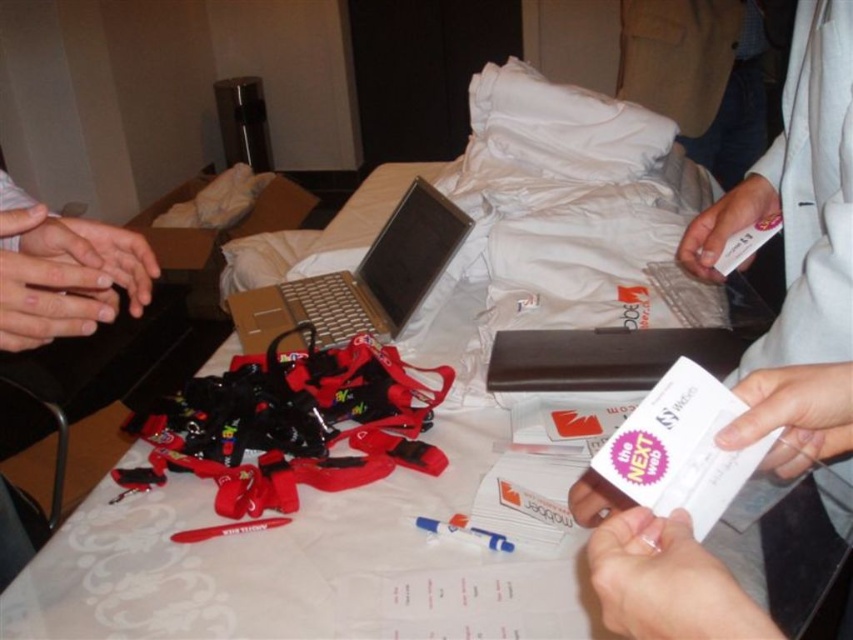
Question: Which of the following is the farthest from the observer?

Choices:
 (A) (566, 333)
 (B) (41, 288)
 (C) (648, 636)
 (D) (16, 342)

Answer: (A)

Question: Is silver metallic laptop at center closer to camera compared to white paper card at center?

Choices:
 (A) yes
 (B) no

Answer: (B)

Question: Is brown leather laptop at center thinner than white paper table at center?

Choices:
 (A) yes
 (B) no

Answer: (B)

Question: Which object is closer to the camera taking this photo?

Choices:
 (A) brown leather laptop at center
 (B) matte black hands at center
 (C) white paper card at center

Answer: (C)

Question: Is silver metallic laptop at center bigger than brown leather laptop at center?

Choices:
 (A) yes
 (B) no

Answer: (A)

Question: Which of the following is the closest to the observer?

Choices:
 (A) (9, 292)
 (B) (608, 611)

Answer: (B)